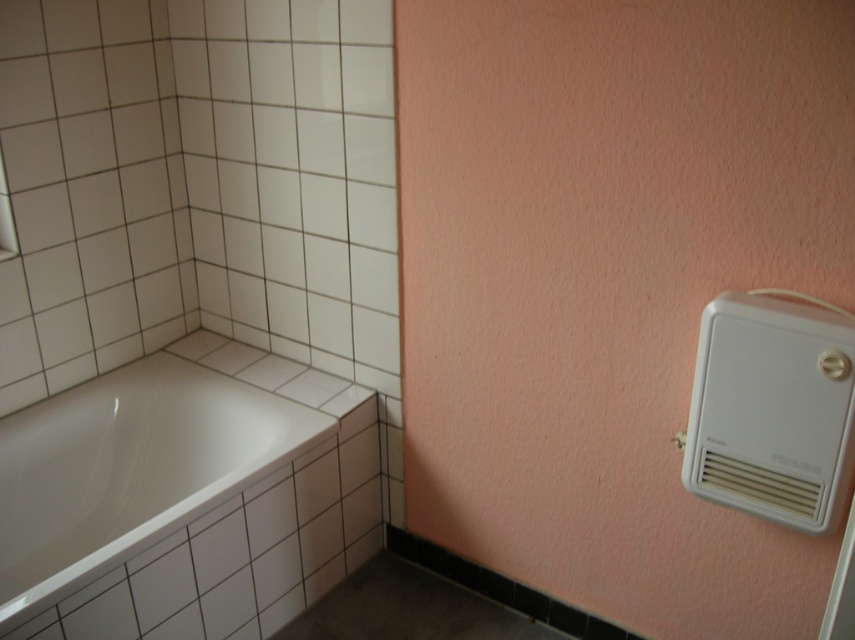
Question: Is white glossy bathtub at lower left below white plastic air conditioner at right?

Choices:
 (A) yes
 (B) no

Answer: (A)

Question: Considering the relative positions of white glossy bathtub at lower left and white plastic air conditioner at right in the image provided, where is white glossy bathtub at lower left located with respect to white plastic air conditioner at right?

Choices:
 (A) above
 (B) below

Answer: (B)

Question: Which point is farther to the camera?

Choices:
 (A) (181, 433)
 (B) (845, 400)

Answer: (A)

Question: Does white glossy bathtub at lower left appear on the left side of white plastic air conditioner at right?

Choices:
 (A) no
 (B) yes

Answer: (B)

Question: Among these points, which one is farthest from the camera?

Choices:
 (A) (814, 500)
 (B) (187, 387)

Answer: (B)